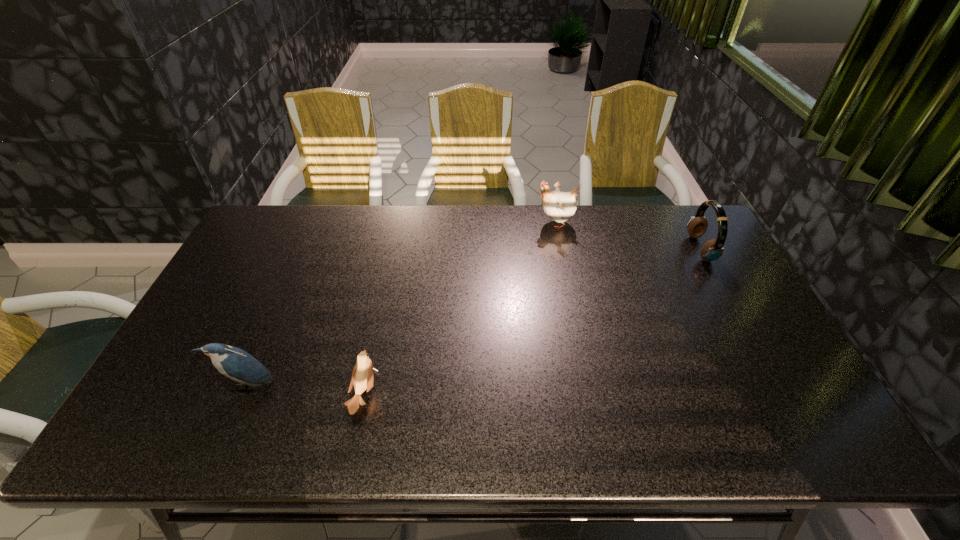
Locate an element on the screen. free space at the far edge of the desktop is located at coordinates (521, 224).

In the image, there is a desktop. Identify the location of free region at the near edge. (451, 450).

Find the location of a particular element. This screenshot has width=960, height=540. free space at the left edge of the desktop is located at coordinates (194, 360).

Find the location of `vacant space at the right edge of the desktop`. vacant space at the right edge of the desktop is located at coordinates (752, 319).

The image size is (960, 540). Find the location of `vacant space at the near left corner of the desktop`. vacant space at the near left corner of the desktop is located at coordinates (158, 429).

Where is `free space between the headset and the shortest bird`? free space between the headset and the shortest bird is located at coordinates (533, 322).

Identify the location of empty space between the leftmost bird and the second bird from right to left. This screenshot has height=540, width=960. (305, 390).

Locate an element on the screen. This screenshot has width=960, height=540. vacant space that's between the rightmost bird and the headset is located at coordinates (628, 236).

Locate an element on the screen. The width and height of the screenshot is (960, 540). vacant space in between the second object from right to left and the second bird from left to right is located at coordinates (460, 309).

Identify the location of unoccupied position between the shortest bird and the headset. (533, 322).